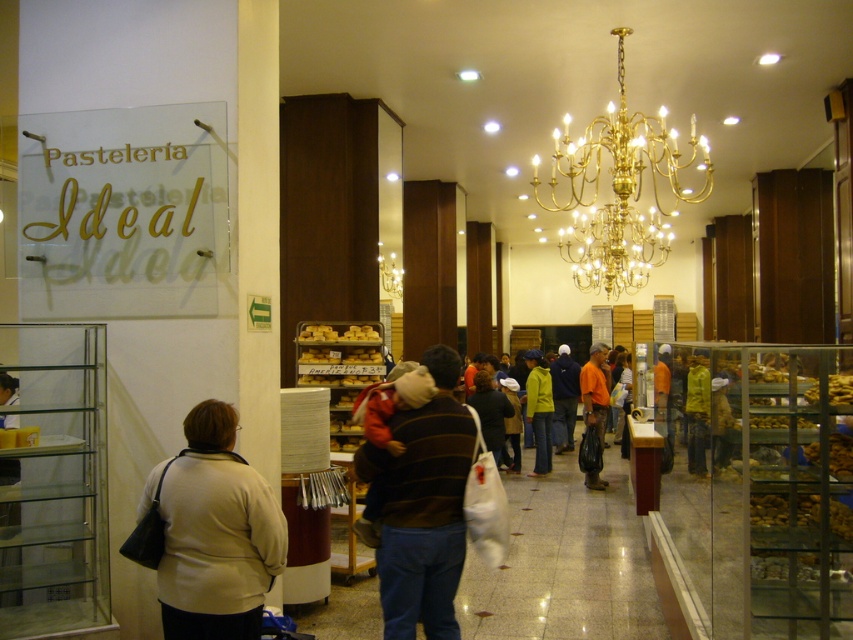
Based on the photo, does brown striped sweater at center have a lesser width compared to gold polished chandelier at upper center?

Correct, brown striped sweater at center's width is less than gold polished chandelier at upper center's.

Who is higher up, brown striped sweater at center or gold polished chandelier at upper center?

gold polished chandelier at upper center

Describe the element at coordinates (421, 506) in the screenshot. I see `brown striped sweater at center` at that location.

This screenshot has height=640, width=853. I want to click on brown striped sweater at center, so click(x=421, y=506).

Which is above, brown striped sweater at center or matte yellow jacket at center?

brown striped sweater at center is higher up.

Does point (448, 561) come closer to viewer compared to point (541, 467)?

Yes.

Does point (453, 576) come farther from viewer compared to point (546, 376)?

No, (453, 576) is closer to viewer.

Identify the location of brown striped sweater at center. The image size is (853, 640). (421, 506).

Measure the distance between brown striped sweater at center and camera.

9.34 feet

Does brown striped sweater at center have a greater width compared to orange fabric bag at center?

No.

I want to click on brown striped sweater at center, so click(421, 506).

Locate an element on the screen. This screenshot has height=640, width=853. brown striped sweater at center is located at coordinates (421, 506).